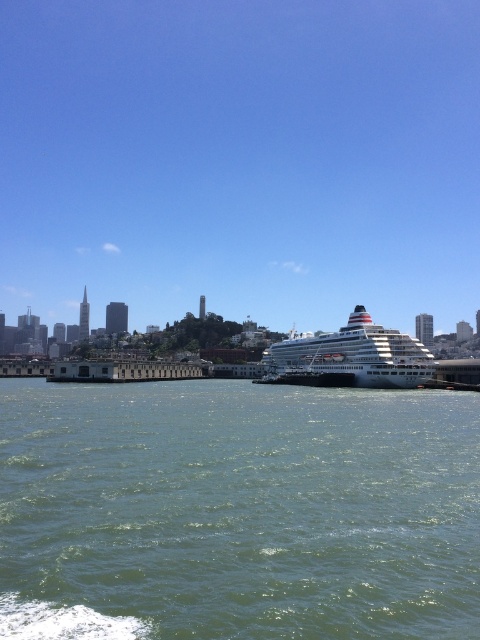
Question: Does green water at center appear on the right side of white glossy cruise ship at center?

Choices:
 (A) no
 (B) yes

Answer: (A)

Question: Does green water at center have a lesser width compared to white glossy cruise ship at center?

Choices:
 (A) no
 (B) yes

Answer: (A)

Question: Which point is closer to the camera taking this photo?

Choices:
 (A) (6, 493)
 (B) (277, 372)

Answer: (A)

Question: Does green water at center have a smaller size compared to white glossy cruise ship at center?

Choices:
 (A) no
 (B) yes

Answer: (B)